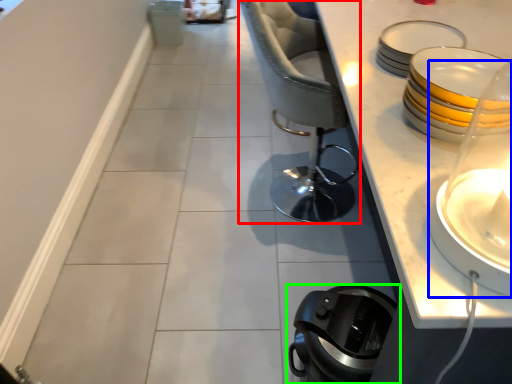
Question: Considering the real-world distances, which object is farthest from chair (highlighted by a red box)? candle holder (highlighted by a blue box) or home appliance (highlighted by a green box)?

Choices:
 (A) candle holder
 (B) home appliance

Answer: (A)